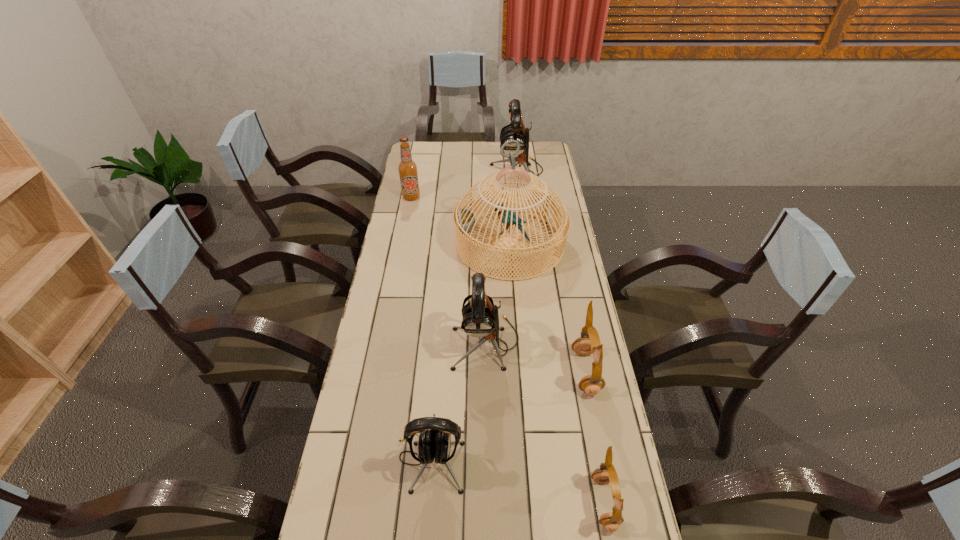
Image resolution: width=960 pixels, height=540 pixels. In the image, there is a desktop. What are the coordinates of `vacant region at the right edge` in the screenshot? It's located at (567, 281).

You are a GUI agent. You are given a task and a screenshot of the screen. Output one action in this format:
    pyautogui.click(x=<x>, y=<y>)
    Task: Click on the free space at the far left corner
    
    Given the screenshot: What is the action you would take?
    pyautogui.click(x=437, y=147)

Where is `vacant area between the second smallest black earphone and the bigger brown earphone`? The image size is (960, 540). vacant area between the second smallest black earphone and the bigger brown earphone is located at coordinates (536, 357).

Image resolution: width=960 pixels, height=540 pixels. In order to click on free spot between the shortest object and the fifth nearest object in this screenshot , I will do `click(557, 373)`.

Image resolution: width=960 pixels, height=540 pixels. What are the coordinates of `empty space between the nearest black earphone and the shortest object` in the screenshot? It's located at (517, 481).

Identify the location of unoccupied position between the smallest black earphone and the bigger brown earphone. This screenshot has width=960, height=540. (508, 416).

Locate an element on the screen. the sixth closest object to the beer bottle is located at coordinates (605, 473).

Locate an element on the screen. The width and height of the screenshot is (960, 540). object that is the nearest to the sixth nearest object is located at coordinates (464, 220).

The image size is (960, 540). I want to click on earphone that is the closest to the nearest black earphone, so click(480, 316).

Choose which earphone is the second nearest neighbor to the second farthest black earphone. Please provide its 2D coordinates. Your answer should be formatted as a tuple, i.e. [(x, y)], where the tuple contains the x and y coordinates of a point satisfying the conditions above.

[(435, 443)]